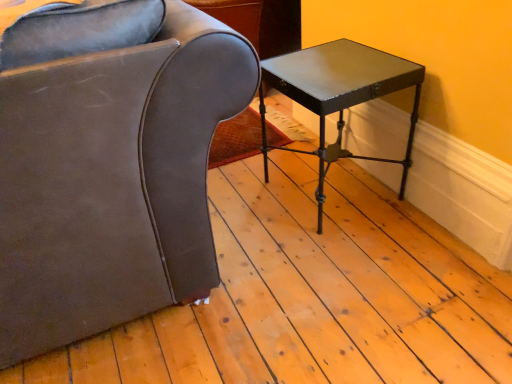
Question: From the image's perspective, does brown leather chair at left appear lower than glossy black table at right?

Choices:
 (A) yes
 (B) no

Answer: (B)

Question: From a real-world perspective, is brown leather chair at left located higher than glossy black table at right?

Choices:
 (A) yes
 (B) no

Answer: (A)

Question: Can you confirm if brown leather chair at left is thinner than glossy black table at right?

Choices:
 (A) no
 (B) yes

Answer: (A)

Question: Does brown leather chair at left appear on the right side of glossy black table at right?

Choices:
 (A) no
 (B) yes

Answer: (A)

Question: Does brown leather chair at left have a larger size compared to glossy black table at right?

Choices:
 (A) yes
 (B) no

Answer: (A)

Question: From a real-world perspective, does brown leather chair at left sit lower than glossy black table at right?

Choices:
 (A) no
 (B) yes

Answer: (A)

Question: Is brown leather chair at left at the back of glossy black table at right?

Choices:
 (A) no
 (B) yes

Answer: (A)

Question: Is glossy black table at right to the right of brown leather chair at left from the viewer's perspective?

Choices:
 (A) no
 (B) yes

Answer: (B)

Question: Is glossy black table at right to the left of brown leather chair at left from the viewer's perspective?

Choices:
 (A) no
 (B) yes

Answer: (A)

Question: Considering the relative sizes of glossy black table at right and brown leather chair at left in the image provided, is glossy black table at right taller than brown leather chair at left?

Choices:
 (A) yes
 (B) no

Answer: (B)

Question: From a real-world perspective, is glossy black table at right physically above brown leather chair at left?

Choices:
 (A) no
 (B) yes

Answer: (A)

Question: Does glossy black table at right have a larger size compared to brown leather chair at left?

Choices:
 (A) yes
 (B) no

Answer: (B)

Question: Is glossy black table at right inside or outside of brown leather chair at left?

Choices:
 (A) outside
 (B) inside

Answer: (A)